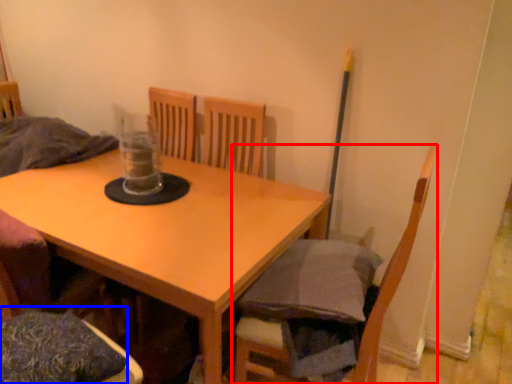
Question: Which point is further to the camera, chair (highlighted by a red box) or pillow (highlighted by a blue box)?

Choices:
 (A) chair
 (B) pillow

Answer: (A)